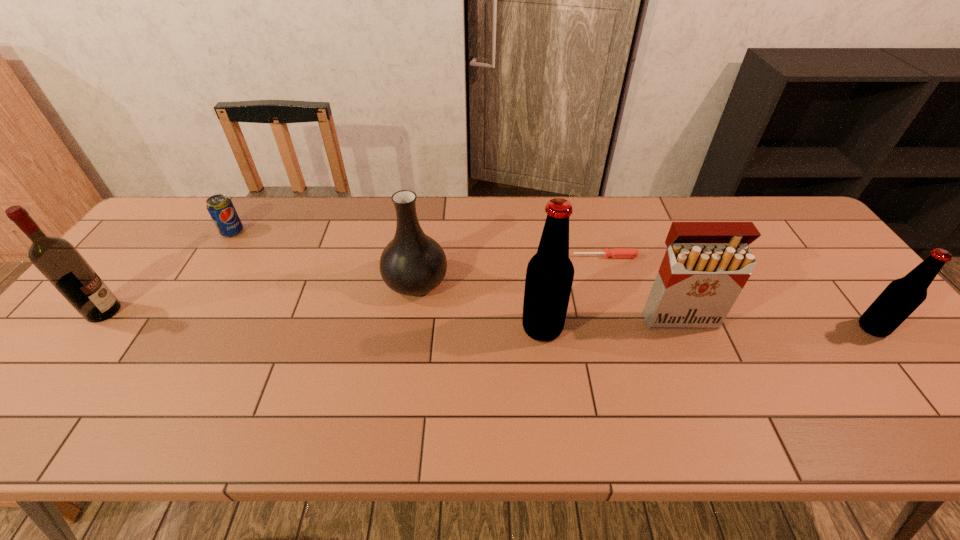
In the image, there is a desktop. At what (x,y) coordinates should I click in order to perform the action: click on vacant space at the far edge. Please return your answer as a coordinate pair (x, y). The height and width of the screenshot is (540, 960). Looking at the image, I should click on (507, 208).

Identify the location of vacant space at the near edge of the desktop. Image resolution: width=960 pixels, height=540 pixels. (771, 388).

The image size is (960, 540). I want to click on free space at the left edge of the desktop, so click(108, 328).

The width and height of the screenshot is (960, 540). What are the coordinates of `free region at the right edge` in the screenshot? It's located at (855, 284).

The height and width of the screenshot is (540, 960). I want to click on vacant position at the far left corner of the desktop, so click(x=190, y=242).

You are a GUI agent. You are given a task and a screenshot of the screen. Output one action in this format:
    pyautogui.click(x=<x>, y=<y>)
    Task: Click on the blank region between the cigarette case and the screwdriver
    
    Given the screenshot: What is the action you would take?
    pyautogui.click(x=642, y=287)

The height and width of the screenshot is (540, 960). I want to click on vacant area that lies between the taller beer bottle and the alcohol, so click(323, 320).

Find the location of a particular element. The width and height of the screenshot is (960, 540). unoccupied area between the left beer bottle and the cigarette case is located at coordinates (611, 323).

Identify the location of free space between the screwdriver and the left beer bottle. (573, 292).

This screenshot has width=960, height=540. What are the coordinates of `unoccupied area between the screwdriver and the leftmost object` in the screenshot? It's located at (354, 284).